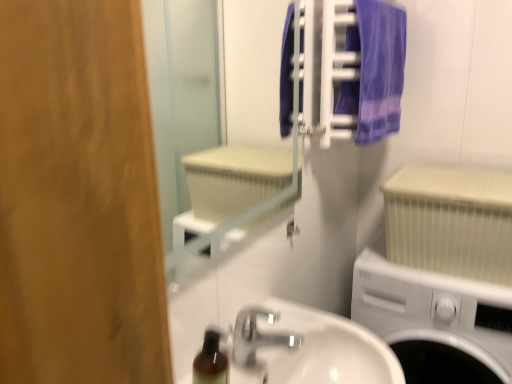
Image resolution: width=512 pixels, height=384 pixels. What do you see at coordinates (435, 321) in the screenshot?
I see `white plastic washing machine at lower right` at bounding box center [435, 321].

Identify the location of white plastic washing machine at lower right. (435, 321).

Describe the element at coordinates (183, 92) in the screenshot. The image size is (512, 384). I see `white textured mirror at upper center` at that location.

Where is `purple fabric towel at upper right`? The width and height of the screenshot is (512, 384). purple fabric towel at upper right is located at coordinates (360, 70).

Find the location of a particular element. The image size is (512, 384). silver metallic faucet at lower center is located at coordinates (258, 335).

Which object is more forward, purple fabric towel at upper right or silver metallic faucet at lower center?

silver metallic faucet at lower center is more forward.

Would you consider purple fabric towel at upper right to be distant from silver metallic faucet at lower center?

No, purple fabric towel at upper right is not far from silver metallic faucet at lower center.

Is purple fabric towel at upper right oriented away from silver metallic faucet at lower center?

No, purple fabric towel at upper right is not facing the opposite direction of silver metallic faucet at lower center.

From their relative heights in the image, would you say purple fabric towel at upper right is taller or shorter than silver metallic faucet at lower center?

purple fabric towel at upper right is taller than silver metallic faucet at lower center.

Looking at their sizes, would you say white plastic washing machine at lower right is wider or thinner than white textured mirror at upper center?

Clearly, white plastic washing machine at lower right has more width compared to white textured mirror at upper center.

Would you say white textured mirror at upper center is part of white plastic washing machine at lower right's contents?

No, white textured mirror at upper center is not inside white plastic washing machine at lower right.

Are white plastic washing machine at lower right and white textured mirror at upper center located far from each other?

They are positioned close to each other.

From the image's perspective, between purple fabric towel at upper right and white plastic washing machine at lower right, who is located below?

white plastic washing machine at lower right appears lower in the image.

Based on the photo, which object is thinner, purple fabric towel at upper right or white plastic washing machine at lower right?

purple fabric towel at upper right is thinner.

Considering the relative sizes of purple fabric towel at upper right and white plastic washing machine at lower right in the image provided, is purple fabric towel at upper right shorter than white plastic washing machine at lower right?

Correct, purple fabric towel at upper right is not as tall as white plastic washing machine at lower right.

From a real-world perspective, which object rests below the other?

From a 3D spatial view, white plastic washing machine at lower right is below.

Considering the positions of objects white glossy sink at center and white plastic washing machine at lower right in the image provided, who is behind, white glossy sink at center or white plastic washing machine at lower right?

white plastic washing machine at lower right.

Which object is positioned more to the right, white glossy sink at center or white plastic washing machine at lower right?

From the viewer's perspective, white plastic washing machine at lower right appears more on the right side.

From a real-world perspective, is white glossy sink at center physically above white textured radiator at right?

No.

How different are the orientations of white glossy sink at center and white textured radiator at right in degrees?

They differ by 88.5 degrees in their facing directions.

Based on the photo, is white glossy sink at center facing towards white textured radiator at right?

No, white glossy sink at center is not aimed at white textured radiator at right.

Does white glossy sink at center appear on the left side of white textured radiator at right?

Indeed, white glossy sink at center is positioned on the left side of white textured radiator at right.

Is point (367, 30) closer to viewer compared to point (302, 337)?

That is False.

Considering the relative positions of purple fabric towel at upper right and white glossy sink at center in the image provided, is purple fabric towel at upper right to the right of white glossy sink at center from the viewer's perspective?

Indeed, purple fabric towel at upper right is positioned on the right side of white glossy sink at center.

Is purple fabric towel at upper right next to white glossy sink at center and touching it?

No, purple fabric towel at upper right is not touching white glossy sink at center.

From the image's perspective, is purple fabric towel at upper right positioned above or below white glossy sink at center?

purple fabric towel at upper right is above white glossy sink at center.

Is white textured radiator at right aimed at silver metallic faucet at lower center?

Yes, white textured radiator at right is oriented towards silver metallic faucet at lower center.

From a real-world perspective, does white textured radiator at right stand above silver metallic faucet at lower center?

Yes, from a real-world perspective, white textured radiator at right is above silver metallic faucet at lower center.

Which of these two, white textured radiator at right or silver metallic faucet at lower center, stands shorter?

silver metallic faucet at lower center.

Considering the positions of point (397, 173) and point (234, 353), is point (397, 173) closer or farther from the camera than point (234, 353)?

Point (397, 173) is positioned farther from the camera compared to point (234, 353).

Where is `tap on the left of purple fabric towel at upper right`? The width and height of the screenshot is (512, 384). tap on the left of purple fabric towel at upper right is located at coordinates (258, 335).

The width and height of the screenshot is (512, 384). Find the location of `washing machine beneath the white textured mirror at upper center (from a real-world perspective)`. washing machine beneath the white textured mirror at upper center (from a real-world perspective) is located at coordinates (435, 321).

Looking at the image, which one is located closer to silver metallic faucet at lower center, purple fabric towel at upper right or purple fabric towel at upper right?

purple fabric towel at upper right is positioned closer to the anchor silver metallic faucet at lower center.

From the image, which object appears to be nearer to white plastic washing machine at lower right, white textured mirror at upper center or purple fabric towel at upper right?

purple fabric towel at upper right.

From the image, which object appears to be farther from white textured mirror at upper center, purple fabric towel at upper right or white textured radiator at right?

white textured radiator at right is further to white textured mirror at upper center.

Based on their spatial positions, is white plastic washing machine at lower right or white glossy sink at center closer to white textured radiator at right?

Based on the image, white plastic washing machine at lower right appears to be nearer to white textured radiator at right.

When comparing their distances from silver metallic faucet at lower center, does white plastic washing machine at lower right or purple fabric towel at upper right seem further?

purple fabric towel at upper right.

Which object lies nearer to the anchor point white textured radiator at right, white textured mirror at upper center or purple fabric towel at upper right?

purple fabric towel at upper right is closer to white textured radiator at right.

Based on their spatial positions, is purple fabric towel at upper right or white glossy sink at center closer to purple fabric towel at upper right?

The object closer to purple fabric towel at upper right is purple fabric towel at upper right.

Which object lies further to the anchor point white glossy sink at center, white textured mirror at upper center or silver metallic faucet at lower center?

Among the two, white textured mirror at upper center is located further to white glossy sink at center.

The height and width of the screenshot is (384, 512). I want to click on tap between white textured mirror at upper center and white glossy sink at center vertically, so (x=258, y=335).

You are a GUI agent. You are given a task and a screenshot of the screen. Output one action in this format:
    pyautogui.click(x=<x>, y=<y>)
    Task: Click on the mirror that lies between purple fabric towel at upper right and white glossy sink at center from top to bottom
    
    Given the screenshot: What is the action you would take?
    pyautogui.click(x=183, y=92)

At what (x,y) coordinates should I click in order to perform the action: click on washing machine between white glossy sink at center and white textured radiator at right in the horizontal direction. Please return your answer as a coordinate pair (x, y). Image resolution: width=512 pixels, height=384 pixels. Looking at the image, I should click on (435, 321).

Locate an element on the screen. The image size is (512, 384). laundry between white textured mirror at upper center and white textured radiator at right in the horizontal direction is located at coordinates (360, 70).